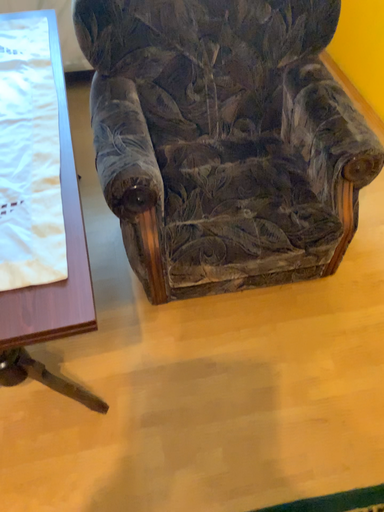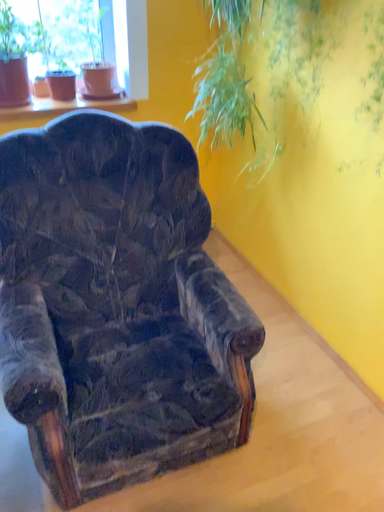
Question: How did the camera likely rotate when shooting the video?

Choices:
 (A) rotated downward
 (B) rotated upward

Answer: (B)